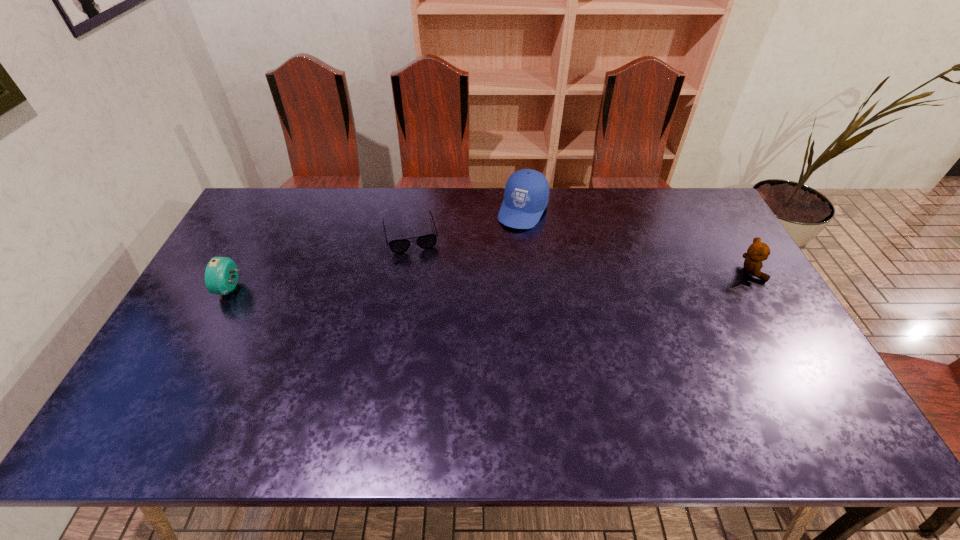
You are a GUI agent. You are given a task and a screenshot of the screen. Output one action in this format:
    pyautogui.click(x=<x>, y=<y>)
    Task: Click on the leftmost object
    
    Given the screenshot: What is the action you would take?
    pyautogui.click(x=221, y=275)

Where is `teddy bear`? teddy bear is located at coordinates (758, 251).

In order to click on cap in this screenshot , I will do `click(526, 194)`.

You are a GUI agent. You are given a task and a screenshot of the screen. Output one action in this format:
    pyautogui.click(x=<x>, y=<y>)
    Task: Click on the third object from right to left
    This screenshot has width=960, height=540.
    Given the screenshot: What is the action you would take?
    pyautogui.click(x=428, y=241)

Identify the location of the shortest object. This screenshot has width=960, height=540. (428, 241).

Find the location of a particular element. The image size is (960, 540). free point located 0.180m on the front-facing side of the third object from left to right is located at coordinates (496, 264).

What are the coordinates of `vacant area situated on the front-facing side of the third object from left to right` in the screenshot? It's located at (498, 260).

At what (x,y) coordinates should I click in order to perform the action: click on vacant position located on the front-facing side of the third object from left to right. Please return your answer as a coordinate pair (x, y). Looking at the image, I should click on (469, 312).

The image size is (960, 540). I want to click on vacant space located 0.360m on the front-facing side of the third object from right to left, so click(436, 343).

The image size is (960, 540). What are the coordinates of `vacant space located 0.170m on the front-facing side of the third object from right to left` in the screenshot? It's located at click(423, 292).